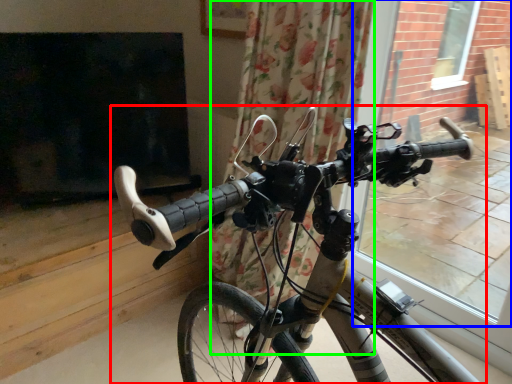
Question: Which is nearer to the bicycle (highlighted by a red box)? window frame (highlighted by a blue box) or curtain (highlighted by a green box).

Choices:
 (A) window frame
 (B) curtain

Answer: (B)